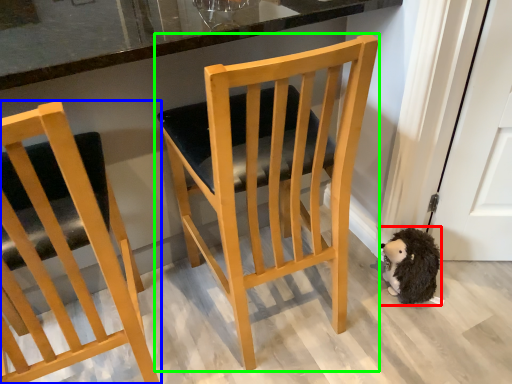
Question: Based on their relative distances, which object is farther from animal (highlighted by a red box)? Choose from chair (highlighted by a blue box) and chair (highlighted by a green box).

Choices:
 (A) chair
 (B) chair

Answer: (A)